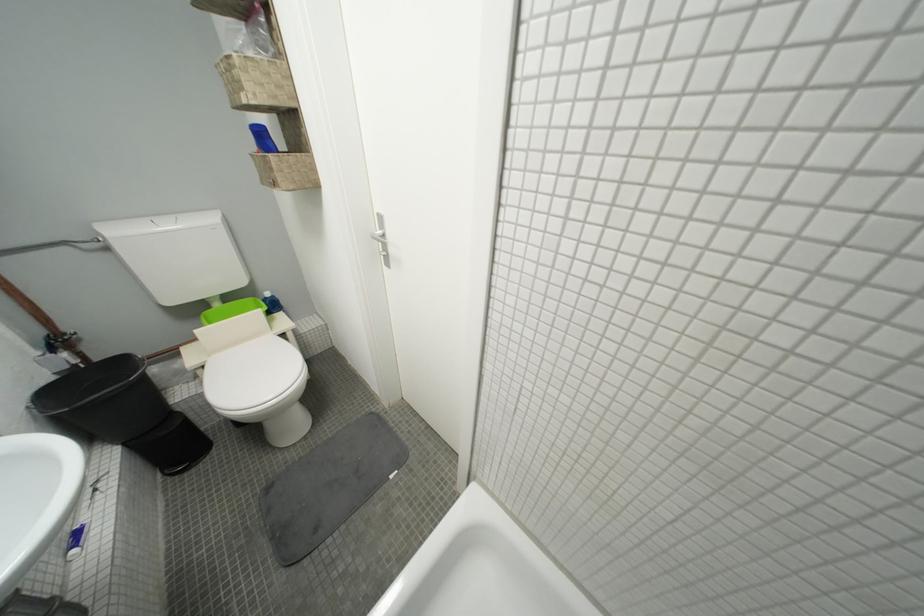
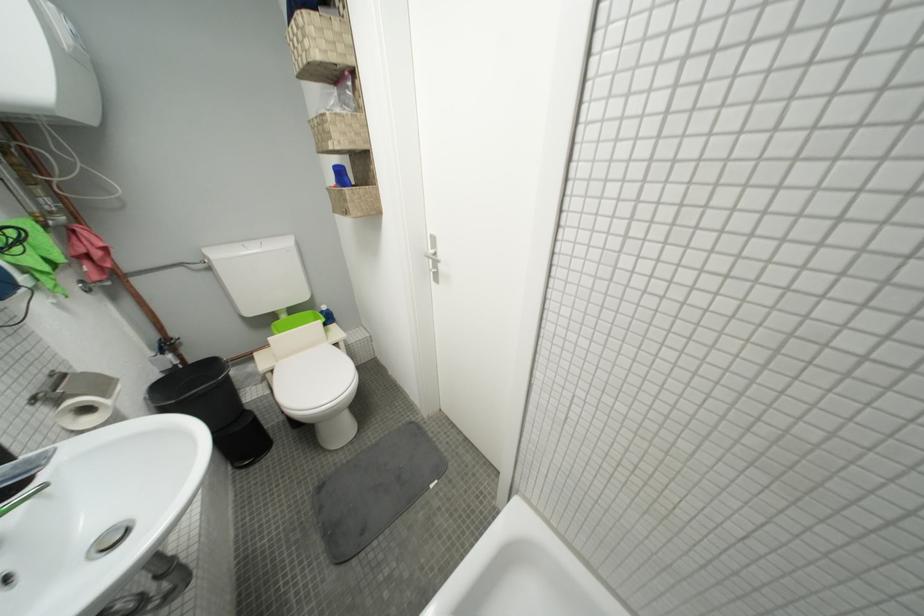
Locate, in the second image, the point that corresponds to point 226,307 in the first image.

(293, 318)